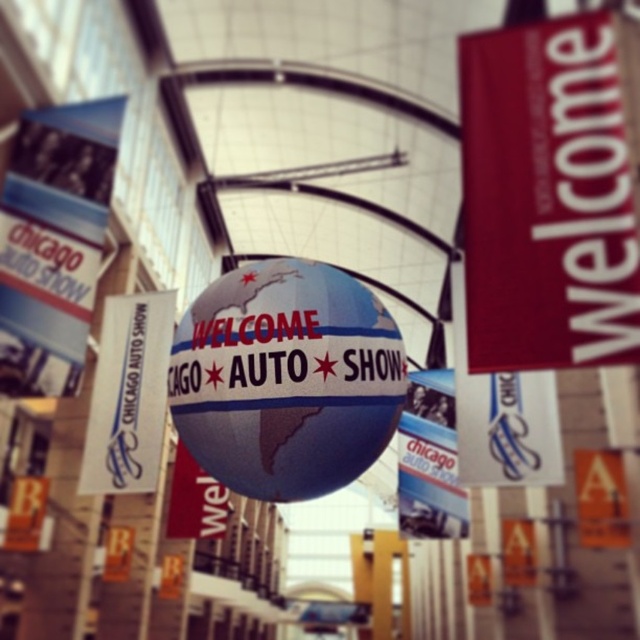
Question: Where is red matte welcome sign at upper right located in relation to white glossy sign at center in the image?

Choices:
 (A) above
 (B) below

Answer: (A)

Question: Which point is closer to the camera?

Choices:
 (A) (115, 368)
 (B) (490, 172)
 (C) (324, 419)

Answer: (C)

Question: Does shiny metallic globe at center appear under white glossy sign at center?

Choices:
 (A) yes
 (B) no

Answer: (B)

Question: Observing the image, what is the correct spatial positioning of shiny metallic globe at center in reference to white glossy sign at center?

Choices:
 (A) below
 (B) above

Answer: (B)

Question: Which point is closer to the camera?

Choices:
 (A) (548, 26)
 (B) (108, 438)

Answer: (A)

Question: Which object is the farthest from the red matte welcome sign at upper right?

Choices:
 (A) shiny metallic globe at center
 (B) white glossy sign at center

Answer: (B)